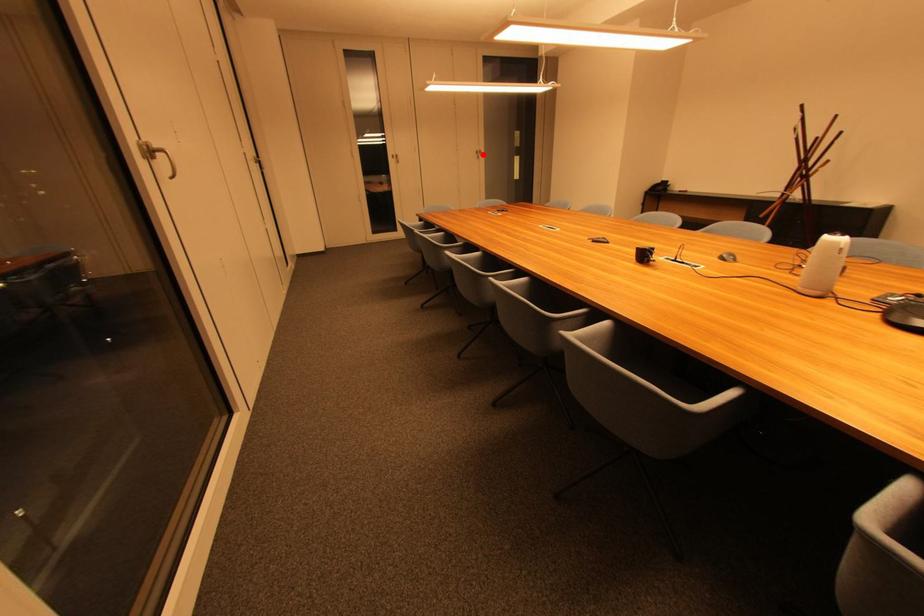
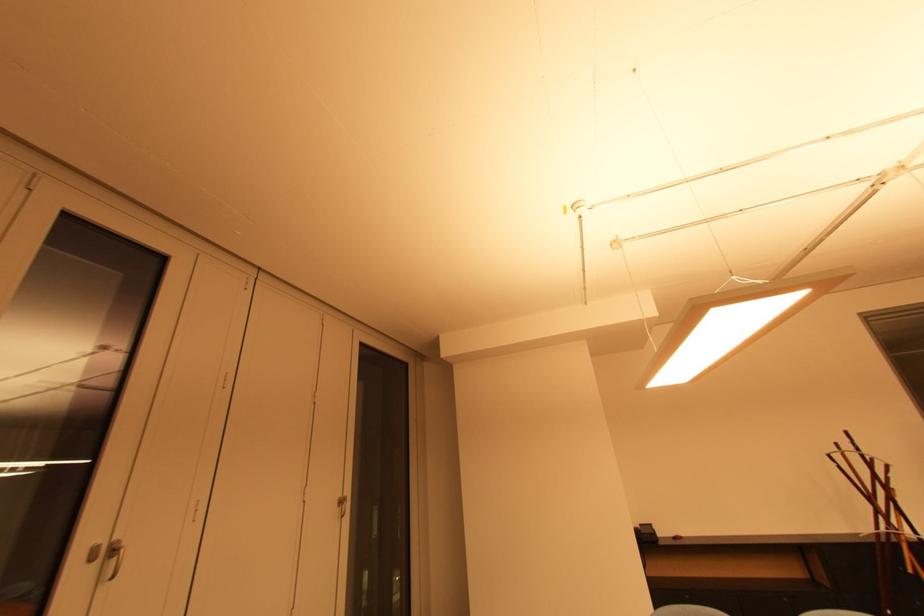
Question: I am providing you with two images of the same scene from different viewpoints. In image1, a red point is highlighted. Considering the same 3D point in image2, which of the following is correct?

Choices:
 (A) It is closer
 (B) It is farther

Answer: (B)